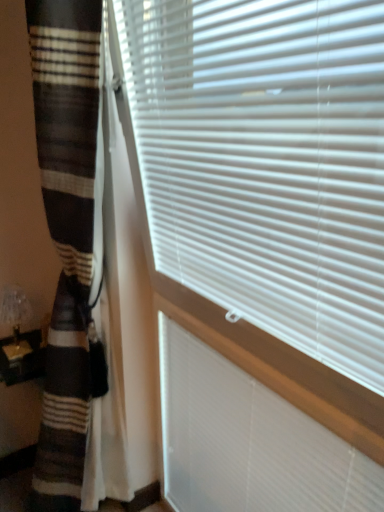
Question: Considering the relative sizes of translucent glass table lamp at lower left and striped wool blanket at left in the image provided, is translucent glass table lamp at lower left wider than striped wool blanket at left?

Choices:
 (A) no
 (B) yes

Answer: (A)

Question: From a real-world perspective, is translucent glass table lamp at lower left under striped wool blanket at left?

Choices:
 (A) yes
 (B) no

Answer: (B)

Question: Does translucent glass table lamp at lower left have a lesser height compared to striped wool blanket at left?

Choices:
 (A) no
 (B) yes

Answer: (B)

Question: Does translucent glass table lamp at lower left have a smaller size compared to striped wool blanket at left?

Choices:
 (A) yes
 (B) no

Answer: (A)

Question: Does translucent glass table lamp at lower left have a lesser width compared to striped wool blanket at left?

Choices:
 (A) yes
 (B) no

Answer: (A)

Question: Considering the positions of brown striped curtain at left and white plastic blinds at center in the image, is brown striped curtain at left wider or thinner than white plastic blinds at center?

Choices:
 (A) wide
 (B) thin

Answer: (A)

Question: Is brown striped curtain at left spatially inside white plastic blinds at center, or outside of it?

Choices:
 (A) outside
 (B) inside

Answer: (A)

Question: Considering their positions, is brown striped curtain at left located in front of or behind white plastic blinds at center?

Choices:
 (A) front
 (B) behind

Answer: (A)

Question: Based on their sizes in the image, would you say brown striped curtain at left is bigger or smaller than white plastic blinds at center?

Choices:
 (A) small
 (B) big

Answer: (B)

Question: Considering the positions of translucent glass table lamp at lower left and brown striped curtain at left in the image, is translucent glass table lamp at lower left wider or thinner than brown striped curtain at left?

Choices:
 (A) wide
 (B) thin

Answer: (B)

Question: In terms of size, does translucent glass table lamp at lower left appear bigger or smaller than brown striped curtain at left?

Choices:
 (A) big
 (B) small

Answer: (B)

Question: From the image's perspective, relative to brown striped curtain at left, is translucent glass table lamp at lower left above or below?

Choices:
 (A) below
 (B) above

Answer: (A)

Question: Is point (26, 298) positioned closer to the camera than point (97, 67)?

Choices:
 (A) farther
 (B) closer

Answer: (A)

Question: Looking at their shapes, would you say white plastic blinds at center is wider or thinner than translucent glass table lamp at lower left?

Choices:
 (A) wide
 (B) thin

Answer: (B)

Question: Looking at the image, does white plastic blinds at center seem bigger or smaller compared to translucent glass table lamp at lower left?

Choices:
 (A) big
 (B) small

Answer: (A)